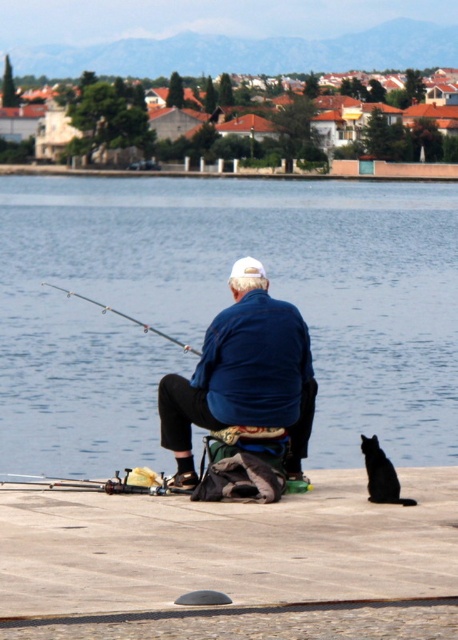
You are a photographer trying to capture the exact position of the brushed metal fishing pole at lower left in the image. What are the coordinates of this object?

The coordinates of the brushed metal fishing pole at lower left are at point (94, 483).

You are a photographer trying to capture the scene with the brushed metal fishing pole at lower left and the black fur cat at lower right. From your current position, which object is located more to the left?

The brushed metal fishing pole at lower left is positioned on the left side of the black fur cat at lower right, so it is more to the left.

You are an observer looking at the waterfront scene. You notice the blue water at center and the silver metallic fishing pole at left. Which object is closer to you?

The blue water at center is closer to you because the silver metallic fishing pole at left is behind it.